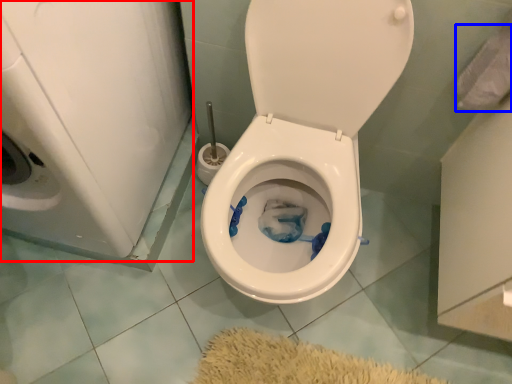
Question: Which of the following is the closest to the observer, washer (highlighted by a red box) or toilet paper (highlighted by a blue box)?

Choices:
 (A) washer
 (B) toilet paper

Answer: (A)